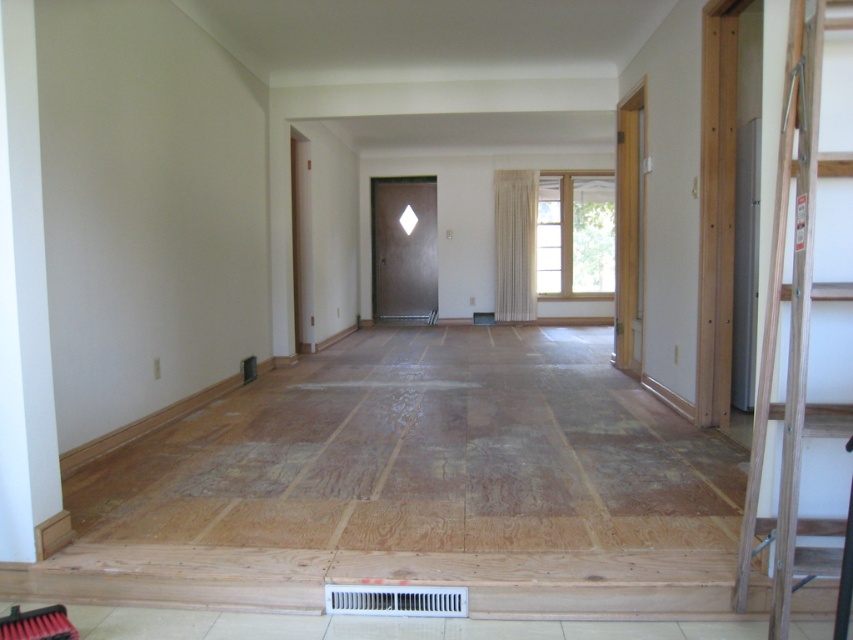
Question: Does matte dark brown door at center appear under white plastic air conditioner at lower center?

Choices:
 (A) yes
 (B) no

Answer: (B)

Question: Is wooden ladder at right above white plastic air conditioner at lower center?

Choices:
 (A) yes
 (B) no

Answer: (A)

Question: Does wooden ladder at right have a lesser width compared to matte dark brown door at center?

Choices:
 (A) no
 (B) yes

Answer: (B)

Question: Which of the following is the farthest from the observer?

Choices:
 (A) matte dark brown door at center
 (B) white plastic air conditioner at lower center

Answer: (A)

Question: Which of these objects is positioned farthest from the white plastic air conditioner at lower center?

Choices:
 (A) matte dark brown door at center
 (B) wooden ladder at right

Answer: (A)

Question: Considering the real-world distances, which object is closest to the matte dark brown door at center?

Choices:
 (A) wooden ladder at right
 (B) white plastic air conditioner at lower center

Answer: (B)